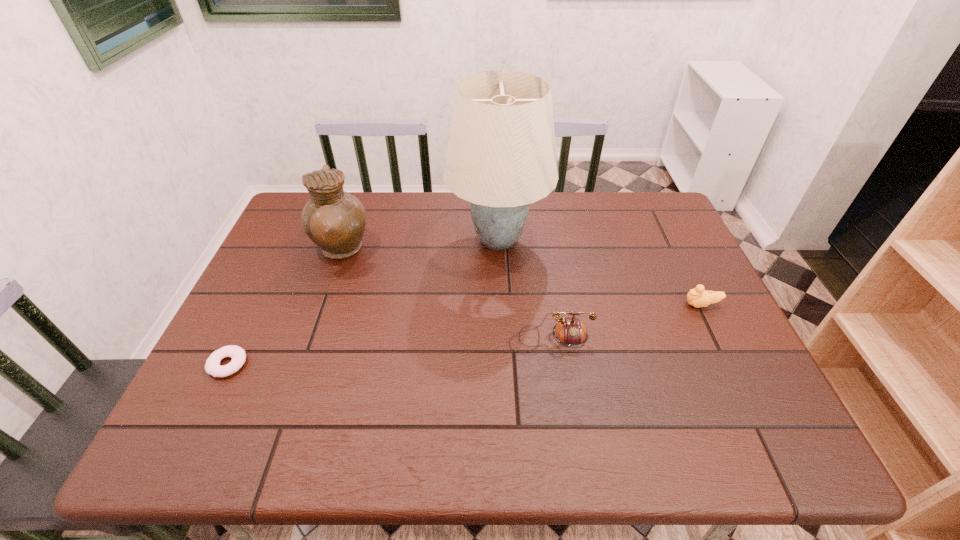
Where is `vacant area that lies between the telephone and the rightmost object`? This screenshot has height=540, width=960. vacant area that lies between the telephone and the rightmost object is located at coordinates (626, 322).

You are a GUI agent. You are given a task and a screenshot of the screen. Output one action in this format:
    pyautogui.click(x=<x>, y=<y>)
    Task: Click on the free spot between the duckling and the lampshade
    
    Given the screenshot: What is the action you would take?
    pyautogui.click(x=600, y=273)

Identify the location of unoccupied position between the tallest object and the third farthest object. (600, 273).

Where is `free space between the tallest object and the third farthest object`? Image resolution: width=960 pixels, height=540 pixels. free space between the tallest object and the third farthest object is located at coordinates (600, 273).

The image size is (960, 540). In order to click on free space between the doughnut and the telephone in this screenshot , I will do `click(390, 352)`.

Select which object appears as the fourth closest to the leftmost object. Please provide its 2D coordinates. Your answer should be formatted as a tuple, i.e. [(x, y)], where the tuple contains the x and y coordinates of a point satisfying the conditions above.

[(698, 297)]

Find the location of a particular element. the closest object to the doughnut is located at coordinates (335, 220).

Find the location of `free space in the image that satisfies the following two spatial constraints: 1. on the face of the duckling; 2. on the rotary dial of the telephone`. free space in the image that satisfies the following two spatial constraints: 1. on the face of the duckling; 2. on the rotary dial of the telephone is located at coordinates (718, 339).

Where is `free location that satisfies the following two spatial constraints: 1. on the front side of the tallest object; 2. at the spout of the second object from left to right`? This screenshot has width=960, height=540. free location that satisfies the following two spatial constraints: 1. on the front side of the tallest object; 2. at the spout of the second object from left to right is located at coordinates (498, 251).